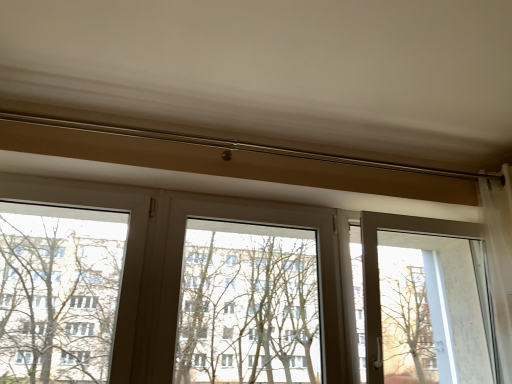
Question: Considering the positions of transparent plastic window screen at center and transparent glass screen door at right in the image, is transparent plastic window screen at center taller or shorter than transparent glass screen door at right?

Choices:
 (A) short
 (B) tall

Answer: (A)

Question: From a real-world perspective, is transparent plastic window screen at center physically located above or below transparent glass screen door at right?

Choices:
 (A) above
 (B) below

Answer: (B)

Question: Estimate the real-world distances between objects in this image. Which object is farther from the transparent glass screen door at right?

Choices:
 (A) green leafy tree at left
 (B) transparent plastic window screen at center

Answer: (A)

Question: Estimate the real-world distances between objects in this image. Which object is closer to the transparent glass screen door at right?

Choices:
 (A) green leafy tree at left
 (B) transparent plastic window screen at center

Answer: (B)